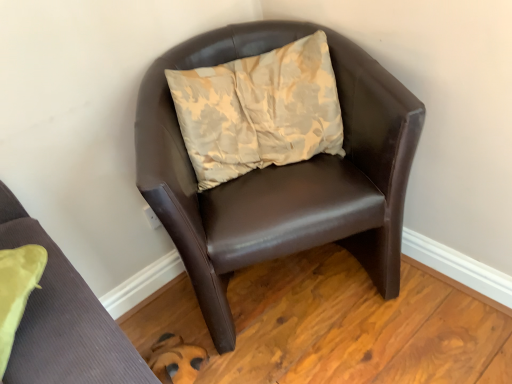
Find the location of a particular element. vacant region under brown leather chair at center, the first chair in the back-to-front sequence (from a real-world perspective) is located at coordinates (297, 284).